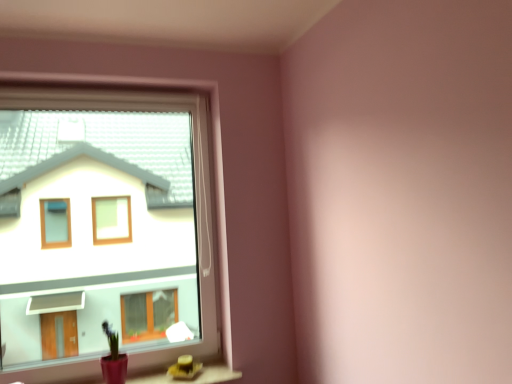
Question: Considering their positions, is matte pink pot at lower left located in front of or behind transparent plastic window at upper left?

Choices:
 (A) behind
 (B) front

Answer: (A)

Question: From their relative heights in the image, would you say matte pink pot at lower left is taller or shorter than transparent plastic window at upper left?

Choices:
 (A) tall
 (B) short

Answer: (B)

Question: From a real-world perspective, is matte pink pot at lower left positioned above or below transparent plastic window at upper left?

Choices:
 (A) below
 (B) above

Answer: (A)

Question: From the image's perspective, is transparent plastic window at upper left positioned above or below matte pink pot at lower left?

Choices:
 (A) below
 (B) above

Answer: (B)

Question: Would you say transparent plastic window at upper left is to the left or to the right of matte pink pot at lower left in the picture?

Choices:
 (A) right
 (B) left

Answer: (B)

Question: Based on their sizes in the image, would you say transparent plastic window at upper left is bigger or smaller than matte pink pot at lower left?

Choices:
 (A) big
 (B) small

Answer: (A)

Question: Is transparent plastic window at upper left spatially inside matte pink pot at lower left, or outside of it?

Choices:
 (A) inside
 (B) outside

Answer: (B)